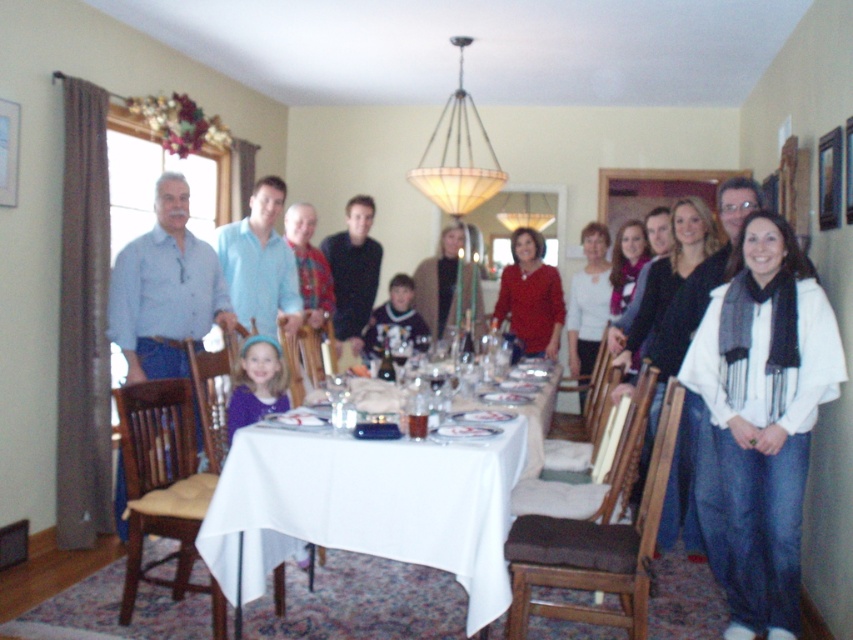
Is point (779, 586) positioned before point (440, 529)?

No, (779, 586) is behind (440, 529).

Does white scarf at center appear on the right side of white cloth table at center?

Correct, you'll find white scarf at center to the right of white cloth table at center.

Find the location of a particular element. This screenshot has height=640, width=853. white scarf at center is located at coordinates (759, 420).

Does white cloth table at center appear on the right side of matte brown sweater at center?

No, white cloth table at center is not to the right of matte brown sweater at center.

Between white cloth table at center and matte brown sweater at center, which one appears on the right side from the viewer's perspective?

Positioned to the right is matte brown sweater at center.

Measure the distance between white cloth table at center and camera.

The distance of white cloth table at center from camera is 2.56 meters.

Find the location of `white cloth table at center`. white cloth table at center is located at coordinates click(x=367, y=506).

This screenshot has height=640, width=853. What do you see at coordinates (367, 506) in the screenshot? I see `white cloth table at center` at bounding box center [367, 506].

Can you confirm if white cloth table at center is thinner than matte white tablecloth at center?

In fact, white cloth table at center might be wider than matte white tablecloth at center.

Is point (241, 493) positioned behind point (656, 228)?

No, (241, 493) is in front of (656, 228).

Identify the location of white cloth table at center. (367, 506).